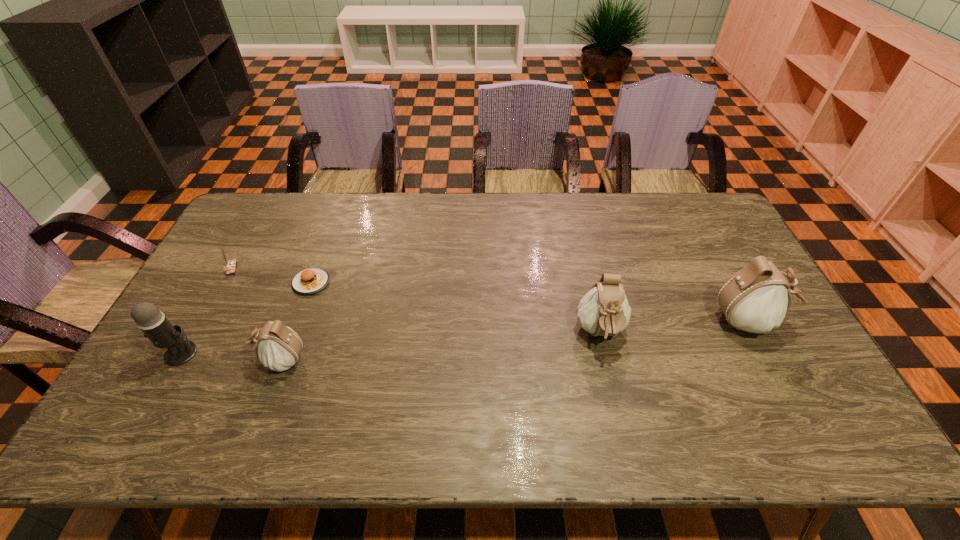
The width and height of the screenshot is (960, 540). I want to click on the shortest pouch, so click(278, 347).

Where is `the leftmost pouch`? The image size is (960, 540). the leftmost pouch is located at coordinates (278, 347).

I want to click on the fifth object from left to right, so click(x=604, y=311).

Find the location of a particular element. Image resolution: width=960 pixels, height=540 pixels. the second tallest pouch is located at coordinates (604, 311).

Where is `the rightmost object`? the rightmost object is located at coordinates (755, 299).

The height and width of the screenshot is (540, 960). I want to click on the tallest pouch, so click(x=755, y=299).

Locate an element on the screen. the second shortest object is located at coordinates (231, 265).

The image size is (960, 540). What are the coordinates of `microphone` in the screenshot? It's located at (152, 322).

Where is `the shortest object`? This screenshot has width=960, height=540. the shortest object is located at coordinates (310, 281).

Locate an element on the screen. vacant point located 0.110m on the front-facing side of the fourth tallest object is located at coordinates (213, 360).